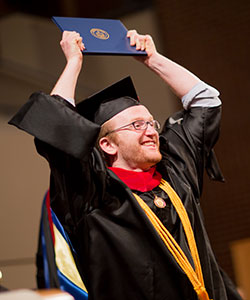
The width and height of the screenshot is (250, 300). In order to click on diploma in this screenshot , I will do `click(102, 38)`.